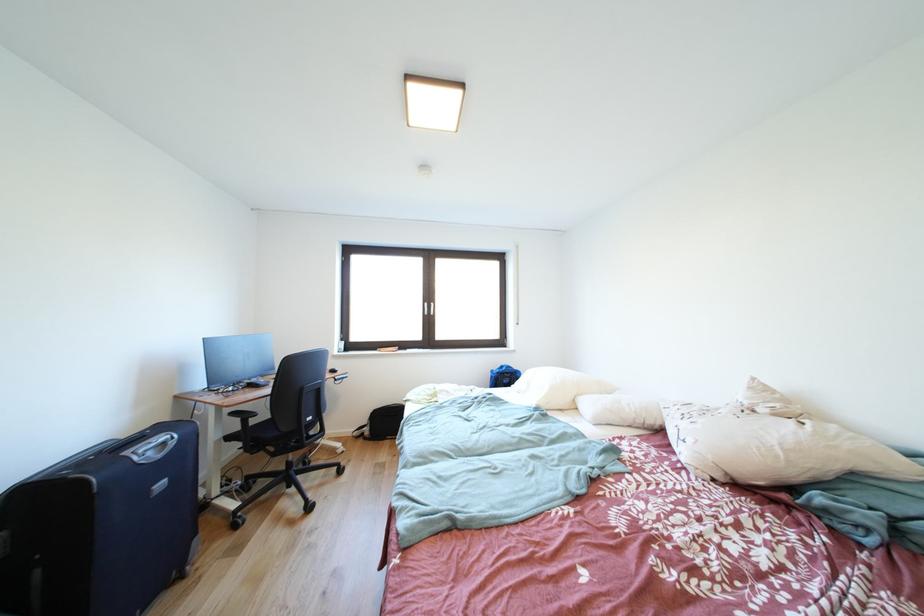
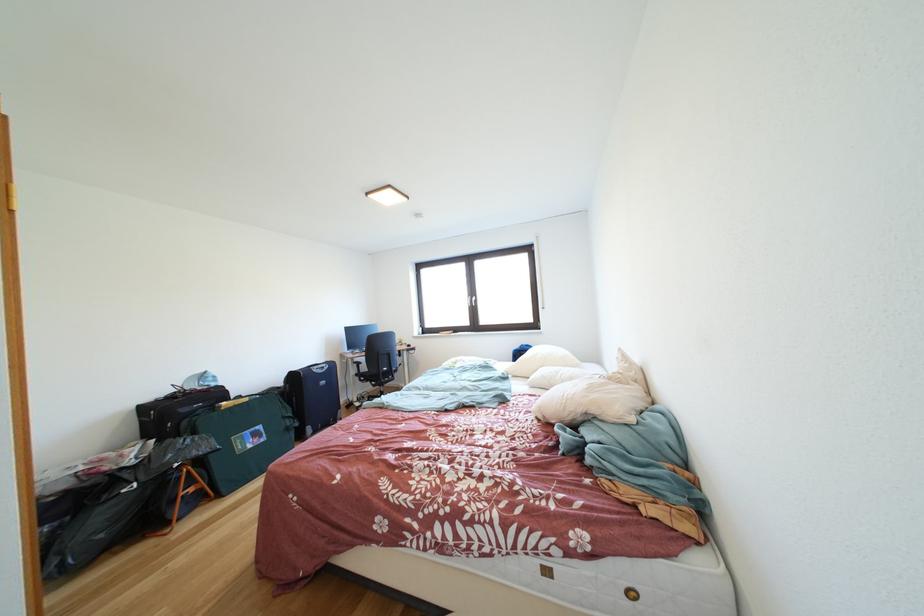
In the second image, find the point that corresponds to (517,371) in the first image.

(535, 351)